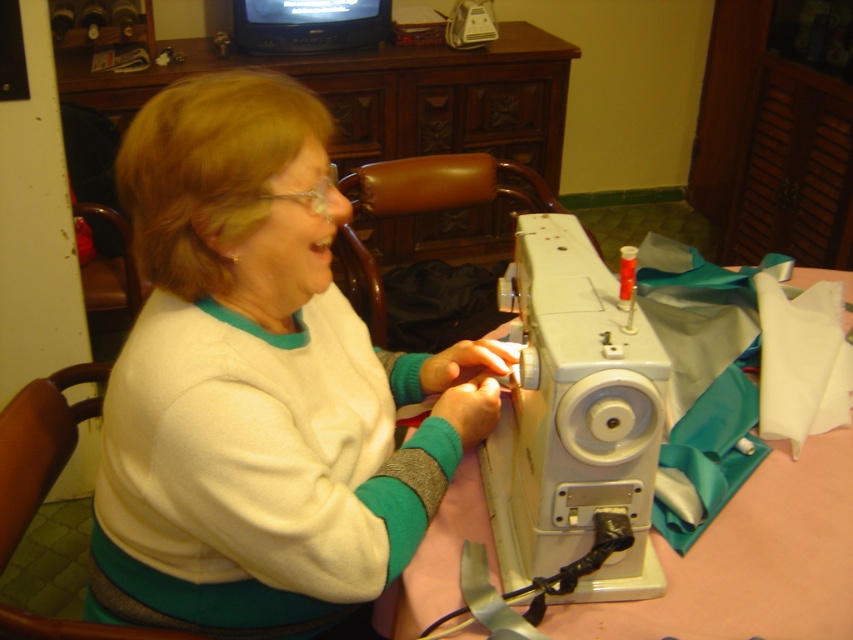
Question: Estimate the real-world distances between objects in this image. Which object is closer to the white fleece sweater at center?

Choices:
 (A) white plastic sewing machine at center
 (B) pink fabric at lower center

Answer: (A)

Question: Does white fleece sweater at center lie in front of pink fabric at lower center?

Choices:
 (A) no
 (B) yes

Answer: (B)

Question: Does white fleece sweater at center appear on the left side of white plastic sewing machine at center?

Choices:
 (A) yes
 (B) no

Answer: (A)

Question: Which is nearer to the pink fabric at lower center?

Choices:
 (A) white fleece sweater at center
 (B) white plastic sewing machine at center

Answer: (B)

Question: Is white fleece sweater at center to the left of white plastic sewing machine at center from the viewer's perspective?

Choices:
 (A) no
 (B) yes

Answer: (B)

Question: Which is nearer to the white fleece sweater at center?

Choices:
 (A) white plastic sewing machine at center
 (B) pink fabric at lower center

Answer: (A)